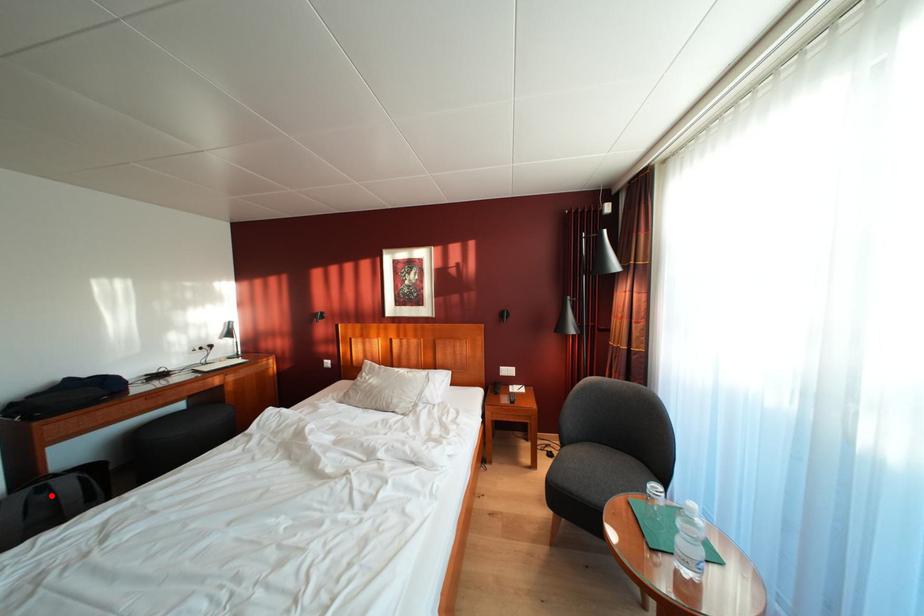
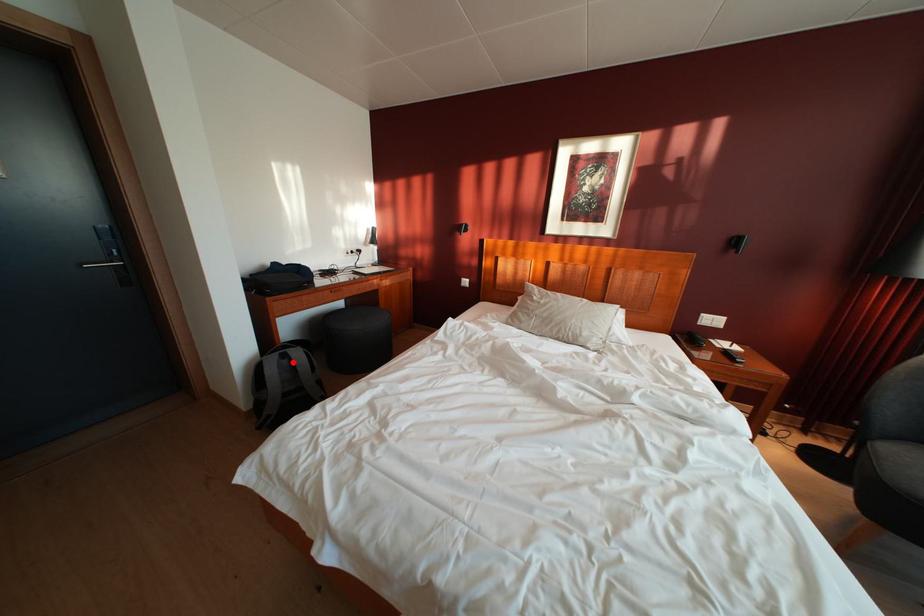
I am providing you with two images of the same scene from different viewpoints. A red point is marked on the first image and another point is marked on the second image. Is the marked point in image1 the same physical position as the marked point in image2?

Yes